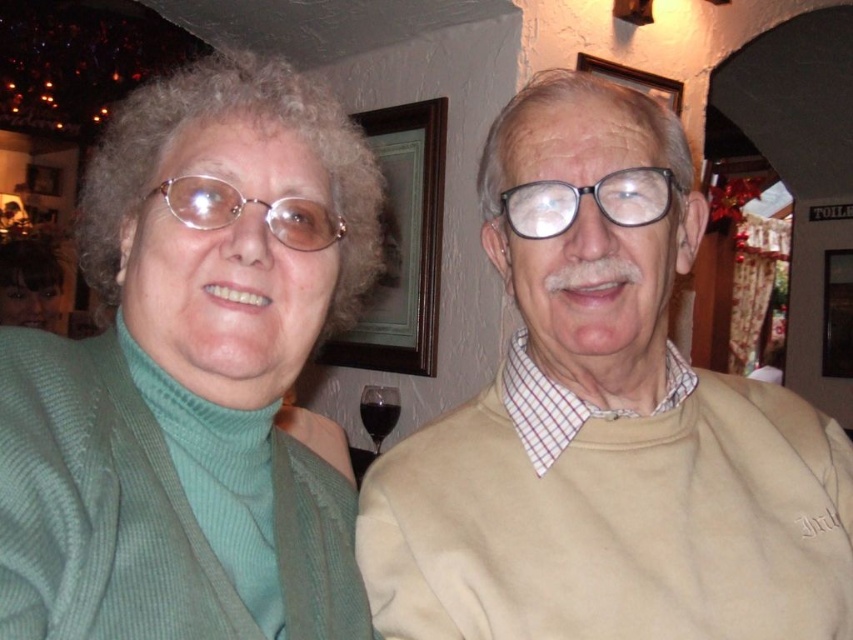
Question: Is smooth brown hair at upper left above transparent glass at lower center?

Choices:
 (A) yes
 (B) no

Answer: (A)

Question: Which point is farther from the camera taking this photo?

Choices:
 (A) (381, 422)
 (B) (94, 273)

Answer: (A)

Question: Among these points, which one is nearest to the camera?

Choices:
 (A) (750, 497)
 (B) (45, 266)
 (C) (358, 406)

Answer: (A)

Question: Among these points, which one is nearest to the camera?

Choices:
 (A) (360, 406)
 (B) (47, 288)

Answer: (A)

Question: In this image, where is beige sweater at right located relative to green ribbed turtleneck sweater at left?

Choices:
 (A) right
 (B) left

Answer: (A)

Question: Does green ribbed turtleneck sweater at left have a larger size compared to smooth brown hair at upper left?

Choices:
 (A) yes
 (B) no

Answer: (B)